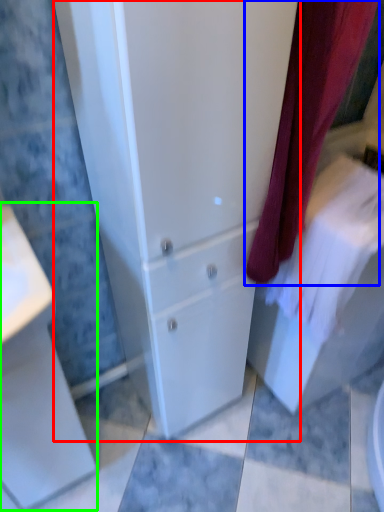
Question: Which is farther away from bathroom cabinet (highlighted by a red box)? curtain (highlighted by a blue box) or porcelain (highlighted by a green box)?

Choices:
 (A) curtain
 (B) porcelain

Answer: (B)